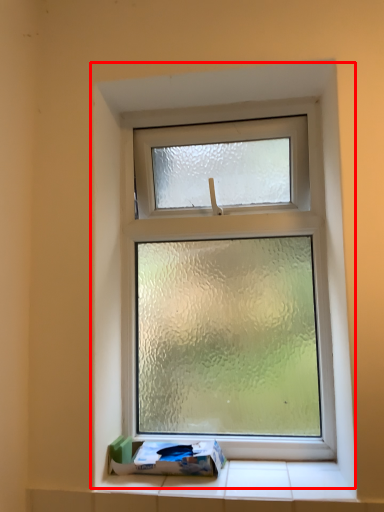
Question: From the image's perspective, where is window (annotated by the red box) located relative to box?

Choices:
 (A) below
 (B) above

Answer: (B)